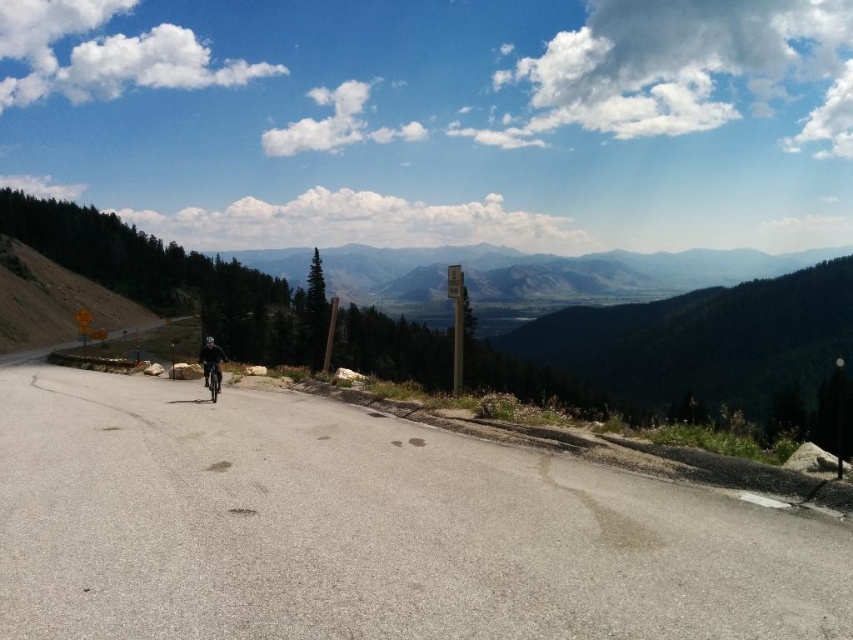
You are a drone operator trying to capture aerial footage of the gray asphalt road at center and the shiny silver motorbike at center. Since the drone has a limited flight altitude, which object would you prioritize capturing first if you need to ensure both are visible without exceeding the altitude limit?

The gray asphalt road at center has a lesser height compared to the shiny silver motorbike at center. To ensure both are visible without exceeding the altitude limit, you should prioritize capturing the shiny silver motorbike at center first, as it is taller and might require a closer or lower altitude to capture details before adjusting for the road.

You are a hiker planning to walk along the paved road in the mountainous landscape. You see a dark gray helmet at center and a shiny silver motorbike at center. Which object is positioned higher relative to the road surface?

The dark gray helmet at center is above the shiny silver motorbike at center, so the dark gray helmet at center is positioned higher relative to the road surface.

You are a delivery driver navigating a mountain route and need to stay on the gray asphalt road at center. What coordinates should you aim for to stay on the road?

The gray asphalt road at center is located at coordinates point (367,529), so you should aim for that point to stay on the road.